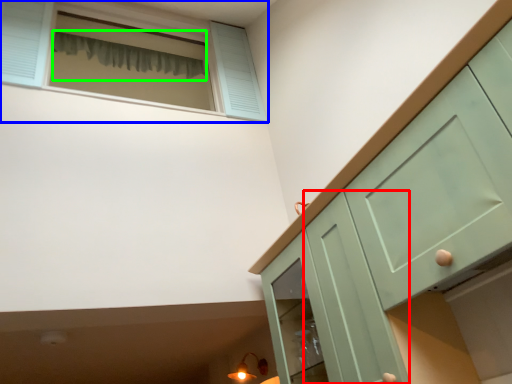
Question: Which object is the farthest from screen door (highlighted by a red box)? Choose among these: window (highlighted by a blue box) or curtain (highlighted by a green box).

Choices:
 (A) window
 (B) curtain

Answer: (B)